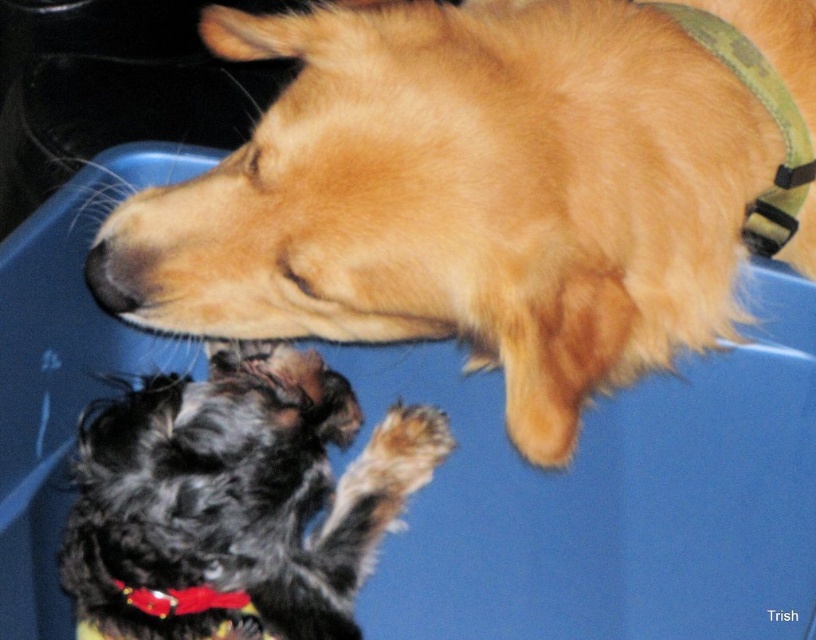
Is golden fur dog at upper center to the right of red fabric neckband at lower center from the viewer's perspective?

Indeed, golden fur dog at upper center is positioned on the right side of red fabric neckband at lower center.

Identify the location of golden fur dog at upper center. (491, 188).

You are a GUI agent. You are given a task and a screenshot of the screen. Output one action in this format:
    pyautogui.click(x=<x>, y=<y>)
    Task: Click on the golden fur dog at upper center
    
    Given the screenshot: What is the action you would take?
    pyautogui.click(x=491, y=188)

This screenshot has width=816, height=640. Identify the location of golden fur dog at upper center. (491, 188).

Does shiny black fur at lower left lie behind red fabric neckband at lower center?

No, it is not.

Who is more forward, (216, 627) or (162, 593)?

Point (162, 593) is more forward.

Where is `shiny black fur at lower left`? shiny black fur at lower left is located at coordinates (236, 499).

Measure the distance from golden fur dog at upper center to shiny black fur at lower left.

28.88 centimeters

Who is more distant from viewer, (308, 136) or (183, 404)?

Point (183, 404)

The height and width of the screenshot is (640, 816). Identify the location of golden fur dog at upper center. (491, 188).

The width and height of the screenshot is (816, 640). In order to click on golden fur dog at upper center in this screenshot , I will do `click(491, 188)`.